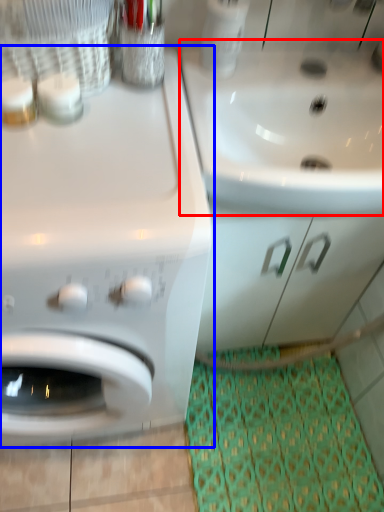
Question: Which point is further to the camera, sink (highlighted by a red box) or washing machine (highlighted by a blue box)?

Choices:
 (A) sink
 (B) washing machine

Answer: (A)